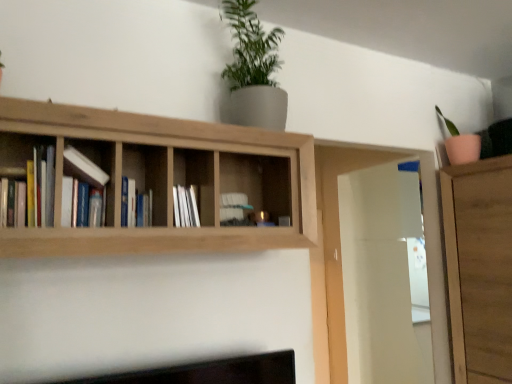
Question: Is light brown wood shelf at upper center bigger or smaller than blue hardcover book at center, the 2th book when ordered from front to back?

Choices:
 (A) big
 (B) small

Answer: (A)

Question: From a real-world perspective, is light brown wood shelf at upper center positioned above or below blue hardcover book at center, the 2th book when ordered from front to back?

Choices:
 (A) above
 (B) below

Answer: (A)

Question: Considering the real-world distances, which object is farthest from the white glossy cabinet at center?

Choices:
 (A) blue hardcover book at center, the 2th book when ordered from front to back
 (B) light brown wood shelf at upper center
 (C) green matte plant at upper center
 (D) white matte book at center-left, the 1th book positioned from the front

Answer: (C)

Question: Considering the real-world distances, which object is farthest from the green matte plant at upper center?

Choices:
 (A) light brown wood shelf at upper center
 (B) blue hardcover book at center, the 2th book when ordered from front to back
 (C) white glossy cabinet at center
 (D) white matte book at center-left, the second book in the back-to-front sequence

Answer: (D)